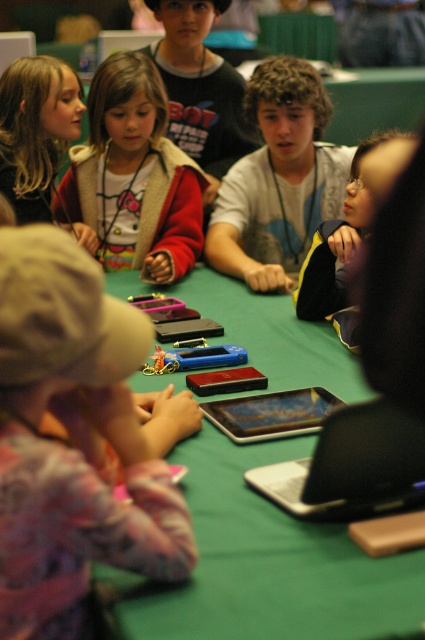
Question: Does matte black jacket at center come in front of black matte tablet at center?

Choices:
 (A) no
 (B) yes

Answer: (B)

Question: Which of the following is the closest to the observer?

Choices:
 (A) (258, 372)
 (B) (47, 172)
 (C) (31, 593)
 (D) (255, 243)

Answer: (C)

Question: Does matte white hoodie at upper left appear over matte black tablet at center?

Choices:
 (A) no
 (B) yes

Answer: (B)

Question: Which point is closer to the camera taking this photo?

Choices:
 (A) (292, 417)
 (B) (309, 289)
 (C) (325, 179)
 (D) (292, 499)

Answer: (D)

Question: Which object is positioned closest to the green matte table at center?

Choices:
 (A) matte white hoodie at upper left
 (B) pink fabric at lower left
 (C) silver metallic laptop at center
 (D) black matte tablet at center

Answer: (C)

Question: Is silver metallic laptop at center to the left of black matte tablet at center from the viewer's perspective?

Choices:
 (A) yes
 (B) no

Answer: (B)